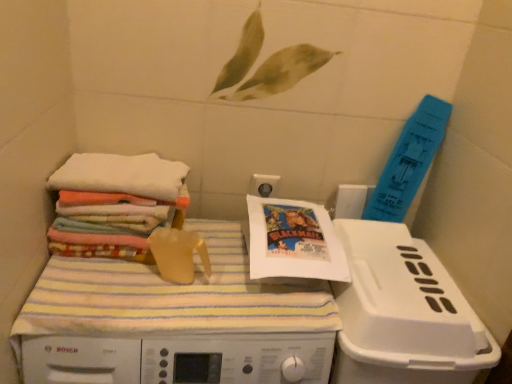
The width and height of the screenshot is (512, 384). Describe the element at coordinates (174, 322) in the screenshot. I see `white plastic machine at center` at that location.

Locate an element on the screen. white soft towels at left is located at coordinates (121, 175).

This screenshot has width=512, height=384. Describe the element at coordinates (121, 175) in the screenshot. I see `white soft towels at left` at that location.

Measure the distance between multicolored fabric stack at left and camera.

34.51 inches.

Locate an element on the screen. This screenshot has width=512, height=384. multicolored fabric stack at left is located at coordinates (115, 204).

Locate an element on the screen. The height and width of the screenshot is (384, 512). white plastic dish washer at lower right is located at coordinates (403, 313).

I want to click on comic book above the white plastic dish washer at lower right (from the image's perspective), so click(x=293, y=241).

Is white paper comic book at center positioned far away from white plastic dish washer at lower right?

white paper comic book at center is near white plastic dish washer at lower right, not far away.

Could you tell me if white paper comic book at center is facing white plastic dish washer at lower right?

No, white paper comic book at center is not facing towards white plastic dish washer at lower right.

From a real-world perspective, who is located lower, white paper comic book at center or white plastic dish washer at lower right?

In real-world perspective, white plastic dish washer at lower right is lower.

Which of these two, multicolored fabric stack at left or white paper comic book at center, stands shorter?

multicolored fabric stack at left is shorter.

Is multicolored fabric stack at left positioned far away from white paper comic book at center?

No.

Is multicolored fabric stack at left thinner than white paper comic book at center?

No, multicolored fabric stack at left is not thinner than white paper comic book at center.

Which point is more distant from viewer, (60, 240) or (298, 266)?

The point (60, 240) is behind.

Is white plastic dish washer at lower right far away from multicolored fabric stack at left?

No.

Consider the image. Which object is thinner, white plastic dish washer at lower right or multicolored fabric stack at left?

multicolored fabric stack at left is thinner.

Considering the relative positions of white plastic dish washer at lower right and multicolored fabric stack at left in the image provided, is white plastic dish washer at lower right behind multicolored fabric stack at left?

No, white plastic dish washer at lower right is closer to the camera.

Does white plastic dish washer at lower right appear on the left side of multicolored fabric stack at left?

In fact, white plastic dish washer at lower right is to the right of multicolored fabric stack at left.

From the image's perspective, is white plastic machine at center beneath white soft towels at left?

Yes.

Considering the sizes of white plastic machine at center and white soft towels at left in the image, is white plastic machine at center bigger or smaller than white soft towels at left?

Considering their sizes, white plastic machine at center takes up more space than white soft towels at left.

From a real-world perspective, is white plastic machine at center positioned over white soft towels at left based on gravity?

No, from a real-world perspective, white plastic machine at center is not on top of white soft towels at left.

Can you confirm if white plastic machine at center is positioned to the right of white soft towels at left?

Correct, you'll find white plastic machine at center to the right of white soft towels at left.

Can you tell me how much white plastic dish washer at lower right and white paper comic book at center differ in facing direction?

white plastic dish washer at lower right and white paper comic book at center are facing 0.115 degrees away from each other.

Is white plastic dish washer at lower right shorter than white paper comic book at center?

No, white plastic dish washer at lower right is not shorter than white paper comic book at center.

From the image's perspective, relative to white paper comic book at center, is white plastic dish washer at lower right above or below?

white plastic dish washer at lower right is situated lower than white paper comic book at center in the image.

Between white plastic dish washer at lower right and white paper comic book at center, which one has smaller size?

white paper comic book at center is smaller.

Does white plastic machine at center turn towards white plastic dish washer at lower right?

No, white plastic machine at center is not aimed at white plastic dish washer at lower right.

Is white plastic machine at center inside the boundaries of white plastic dish washer at lower right, or outside?

white plastic machine at center cannot be found inside white plastic dish washer at lower right.

Based on the photo, between white plastic machine at center and white plastic dish washer at lower right, which one appears on the right side from the viewer's perspective?

white plastic dish washer at lower right.

From a real-world perspective, relative to white plastic dish washer at lower right, is white plastic machine at center vertically above or below?

From a real-world perspective, white plastic machine at center is physically below white plastic dish washer at lower right.

Is multicolored fabric stack at left not within white plastic dish washer at lower right?

Absolutely, multicolored fabric stack at left is external to white plastic dish washer at lower right.

Considering the sizes of objects multicolored fabric stack at left and white plastic dish washer at lower right in the image provided, who is bigger, multicolored fabric stack at left or white plastic dish washer at lower right?

Bigger between the two is white plastic dish washer at lower right.

Is multicolored fabric stack at left directly adjacent to white plastic dish washer at lower right?

No, multicolored fabric stack at left is not touching white plastic dish washer at lower right.

You are a GUI agent. You are given a task and a screenshot of the screen. Output one action in this format:
    pyautogui.click(x=<x>, y=<y>)
    Task: Click on the comic book above the white plastic dish washer at lower right (from the image's perspective)
    The width and height of the screenshot is (512, 384).
    Given the screenshot: What is the action you would take?
    pyautogui.click(x=293, y=241)

Where is `comic book that is below the multicolored fabric stack at left (from the image's perspective)`? The height and width of the screenshot is (384, 512). comic book that is below the multicolored fabric stack at left (from the image's perspective) is located at coordinates (293, 241).

Estimate the real-world distances between objects in this image. Which object is further from multicolored fabric stack at left, white plastic machine at center or white paper comic book at center?

white paper comic book at center lies further to multicolored fabric stack at left than the other object.

Based on their spatial positions, is white plastic dish washer at lower right or white paper comic book at center closer to white plastic machine at center?

white paper comic book at center.

Based on their spatial positions, is white soft towels at left or white paper comic book at center further from multicolored fabric stack at left?

white paper comic book at center is positioned further to the anchor multicolored fabric stack at left.

Based on their spatial positions, is white plastic dish washer at lower right or white soft towels at left closer to white paper comic book at center?

Based on the image, white plastic dish washer at lower right appears to be nearer to white paper comic book at center.

Based on their spatial positions, is white plastic dish washer at lower right or white paper comic book at center closer to multicolored fabric stack at left?

Among the two, white paper comic book at center is located nearer to multicolored fabric stack at left.

Which object lies nearer to the anchor point white soft towels at left, multicolored fabric stack at left or white paper comic book at center?

multicolored fabric stack at left lies closer to white soft towels at left than the other object.

Based on their spatial positions, is white plastic machine at center or white soft towels at left further from white plastic dish washer at lower right?

white soft towels at left.

Looking at the image, which one is located further to white plastic machine at center, white paper comic book at center or multicolored fabric stack at left?

Among the two, white paper comic book at center is located further to white plastic machine at center.

The image size is (512, 384). I want to click on comic book between multicolored fabric stack at left and white plastic machine at center from top to bottom, so click(x=293, y=241).

Identify the location of comic book between white soft towels at left and white plastic machine at center in the vertical direction. (293, 241).

You are a GUI agent. You are given a task and a screenshot of the screen. Output one action in this format:
    pyautogui.click(x=<x>, y=<y>)
    Task: Click on the towel between multicolored fabric stack at left and white plastic dish washer at lower right from left to right
    The height and width of the screenshot is (384, 512).
    Given the screenshot: What is the action you would take?
    pyautogui.click(x=121, y=175)

Image resolution: width=512 pixels, height=384 pixels. Identify the location of comic book situated between white soft towels at left and white plastic dish washer at lower right from left to right. (293, 241).